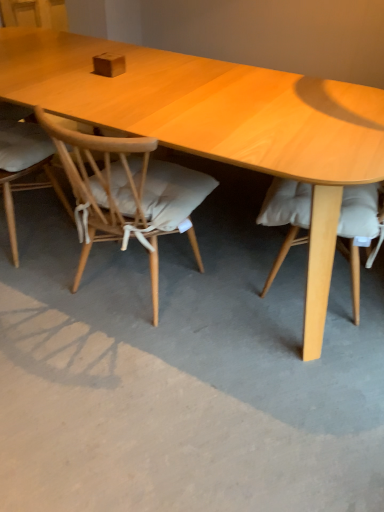
Find the location of a particular element. The image size is (384, 512). free space above gray concrete at center (from a real-world perspective) is located at coordinates (175, 308).